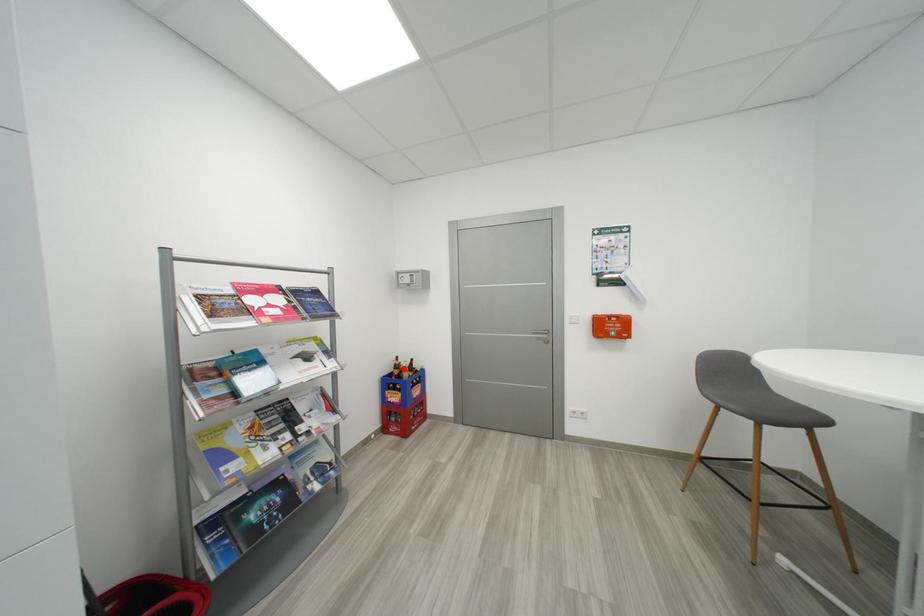
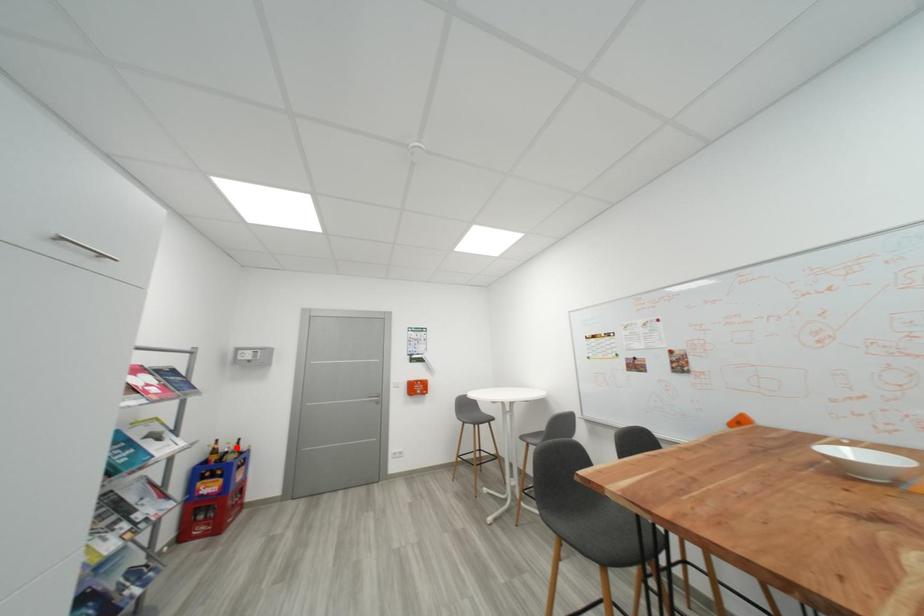
I am providing you with two images of the same scene from different viewpoints. A red point is marked on the first image and another point is marked on the second image. Are the points marked in image1 and image2 representing the same 3D position?

No